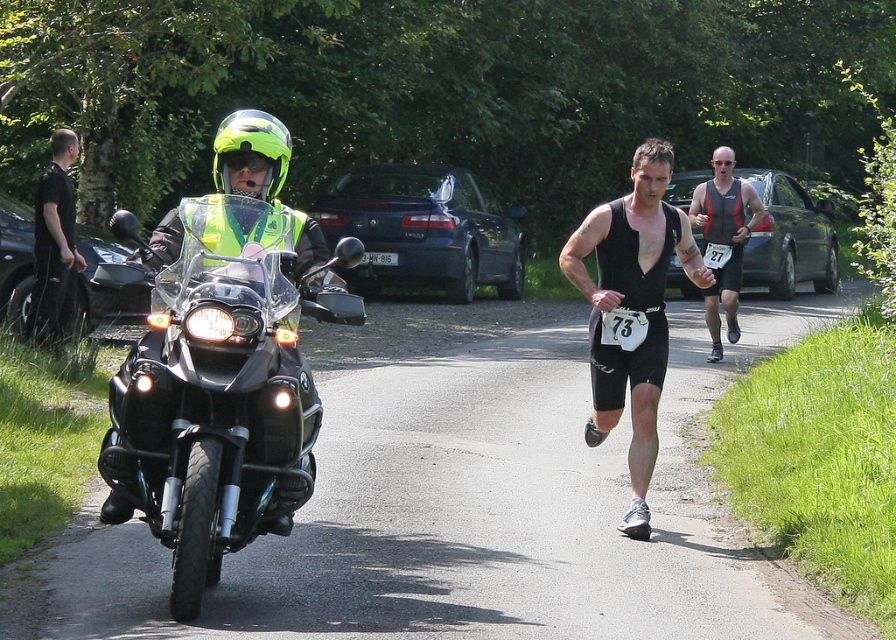
You are a runner in the race and you see the point at coordinates (221, 388). Where is that point located?

The point at coordinates (221, 388) is located on the black matte motorcycle at left.

Consider the image. A motorcyclist on a black BMW motorcycle and two male athletes are participating in an event. The motorcyclist is at point (252, 128). The two athletes are 6.25 meters apart. If the motorcyclist wants to reach both athletes quickly, which athlete should they approach first?

The motorcyclist should approach the athlete closer to their position at point (252, 128) first since they are nearer and would take less time to reach compared to the one farther away.